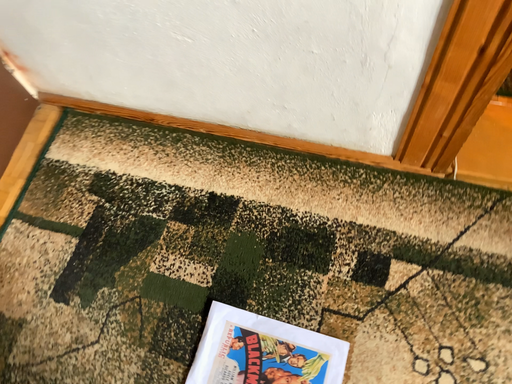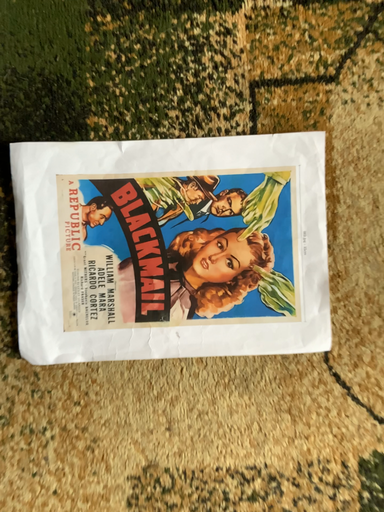
Question: How did the camera likely rotate when shooting the video?

Choices:
 (A) rotated left
 (B) rotated right

Answer: (B)